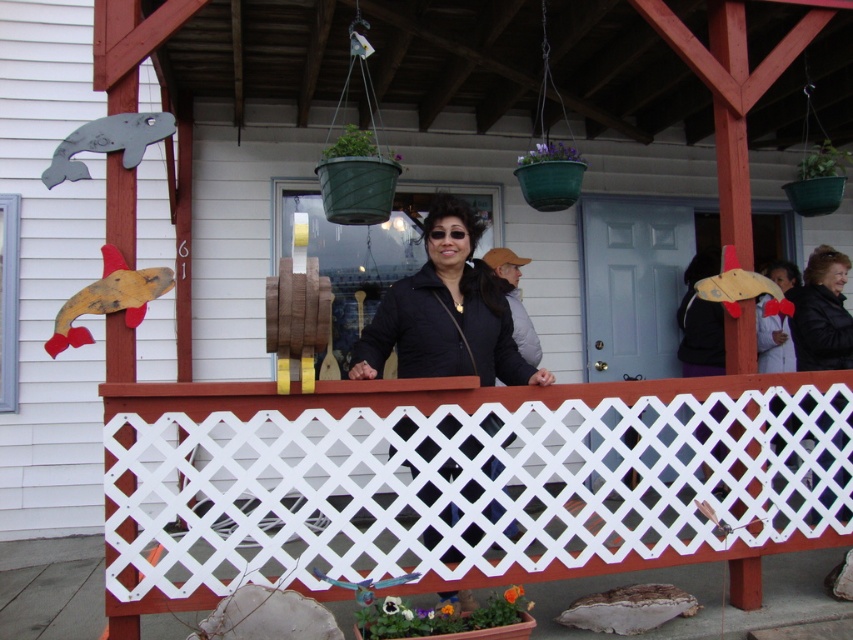
You are a photographer trying to capture the white lattice at center and the black matte jacket at center in the same frame. Which object should you focus on first to ensure both are in the frame without cropping?

The white lattice at center is bigger than the black matte jacket at center, so you should focus on the white lattice at center first to ensure both fit in the frame without cropping.